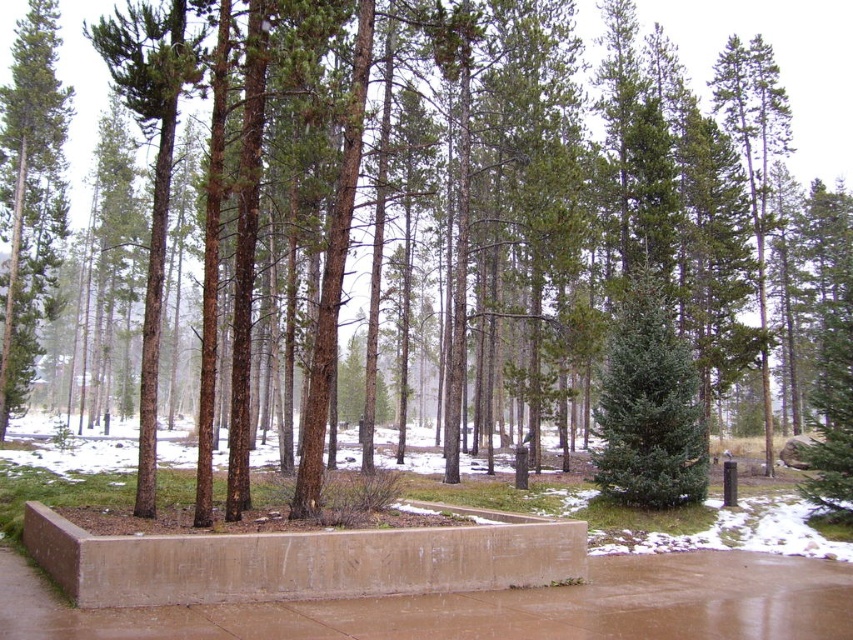
Question: Is brown concrete planter at lower center thinner than green matte tree at left?

Choices:
 (A) no
 (B) yes

Answer: (B)

Question: Which point is farther from the camera taking this photo?

Choices:
 (A) (51, 179)
 (B) (607, 483)
 (C) (76, 600)
 (D) (367, 636)

Answer: (A)

Question: Estimate the real-world distances between objects in this image. Which object is farther from the green matte tree at left?

Choices:
 (A) brown concrete planter at lower center
 (B) green matte evergreen tree at center

Answer: (A)

Question: Considering the relative positions of brown concrete planter at lower center and green matte tree at left in the image provided, where is brown concrete planter at lower center located with respect to green matte tree at left?

Choices:
 (A) above
 (B) below

Answer: (B)

Question: Can you confirm if brown concrete pavement at center is positioned above green matte evergreen tree at center?

Choices:
 (A) yes
 (B) no

Answer: (B)

Question: Which object appears closest to the camera in this image?

Choices:
 (A) green matte evergreen tree at center
 (B) green matte tree at left
 (C) brown concrete pavement at center
 (D) brown concrete planter at lower center

Answer: (C)